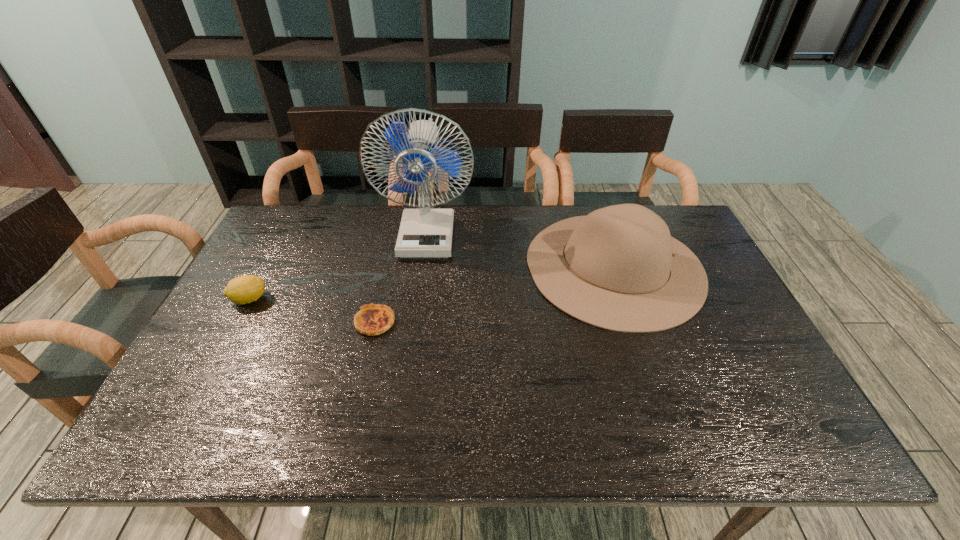
The image size is (960, 540). I want to click on fan present at the far edge, so click(426, 232).

Where is `sombrero situated at the far edge`? sombrero situated at the far edge is located at coordinates (618, 268).

Locate an element on the screen. object present at the left edge is located at coordinates (245, 289).

I want to click on object at the right edge, so click(x=618, y=268).

You are a GUI agent. You are given a task and a screenshot of the screen. Output one action in this format:
    pyautogui.click(x=<x>, y=<y>)
    Task: Click on the object that is at the far right corner
    The width and height of the screenshot is (960, 540).
    Given the screenshot: What is the action you would take?
    pyautogui.click(x=618, y=268)

Find the location of a particular element. Image resolution: width=960 pixels, height=540 pixels. vacant space at the far edge of the desktop is located at coordinates point(468,242).

The height and width of the screenshot is (540, 960). In order to click on vacant space at the near edge in this screenshot , I will do `click(452, 443)`.

Locate an element on the screen. Image resolution: width=960 pixels, height=540 pixels. vacant space at the left edge is located at coordinates (267, 335).

You are a GUI agent. You are given a task and a screenshot of the screen. Output one action in this format:
    pyautogui.click(x=<x>, y=<y>)
    Task: Click on the vacant region at the far left corner of the desktop
    The height and width of the screenshot is (540, 960).
    Given the screenshot: What is the action you would take?
    pyautogui.click(x=273, y=228)

At what (x,y) coordinates should I click in order to perform the action: click on free spot at the near right corner of the desktop. Please return your answer as a coordinate pair (x, y). Image resolution: width=960 pixels, height=540 pixels. Looking at the image, I should click on (803, 429).